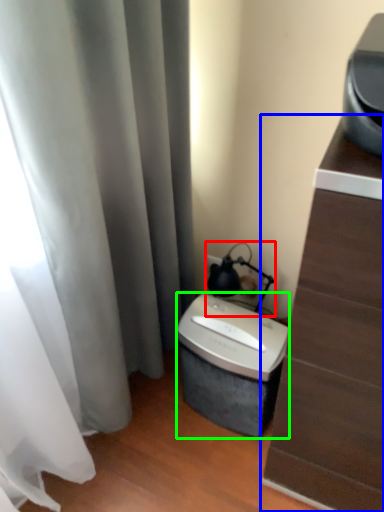
Question: Which object is positioned closest to table lamp (highlighted by a red box)? Select from furniture (highlighted by a blue box) and appliance (highlighted by a green box).

Choices:
 (A) furniture
 (B) appliance

Answer: (B)